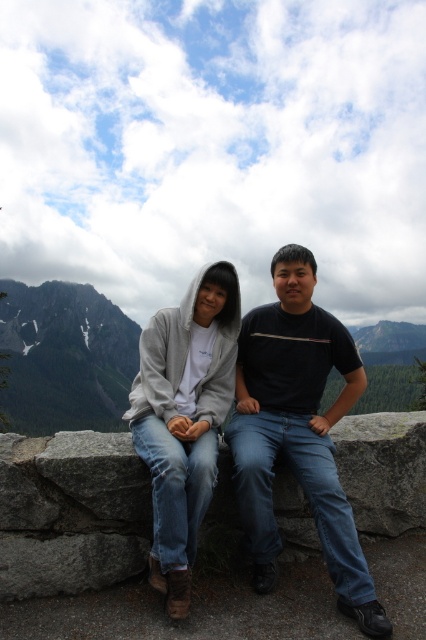
Does matte gray hoodie at center have a lesser height compared to gray rocky mountain at left?

Indeed, matte gray hoodie at center has a lesser height compared to gray rocky mountain at left.

Which is in front, point (196, 496) or point (68, 381)?

Point (196, 496) is more forward.

Find the location of `matte gray hoodie at center`. matte gray hoodie at center is located at coordinates (184, 419).

Does black matte shirt at center appear over matte gray hoodie at center?

No, black matte shirt at center is not above matte gray hoodie at center.

Can you confirm if black matte shirt at center is thinner than matte gray hoodie at center?

No, black matte shirt at center is not thinner than matte gray hoodie at center.

What do you see at coordinates (298, 429) in the screenshot? I see `black matte shirt at center` at bounding box center [298, 429].

The width and height of the screenshot is (426, 640). I want to click on black matte shirt at center, so click(298, 429).

Between black matte shirt at center and gray rocky mountain at left, which one is positioned lower?

gray rocky mountain at left is lower down.

Who is more forward, (x=279, y=305) or (x=25, y=428)?

Point (x=279, y=305) is in front.

Describe the element at coordinates (298, 429) in the screenshot. I see `black matte shirt at center` at that location.

Find the location of a particular element. The image size is (426, 640). black matte shirt at center is located at coordinates (298, 429).